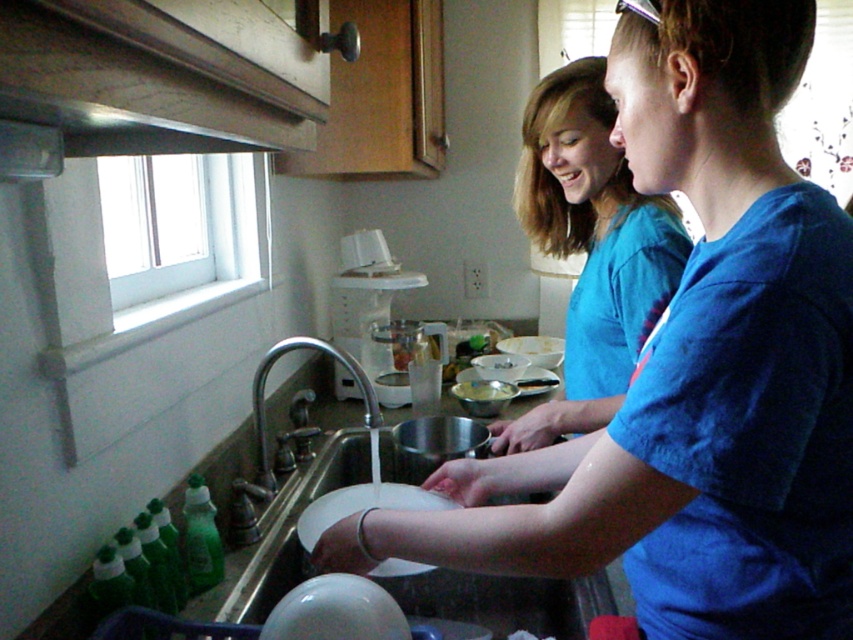
Between point (585, 362) and point (257, 369), which one is positioned behind?

Point (257, 369)

Can you confirm if blue cotton shirt at center is wider than silver metallic faucet at sink left?

Correct, the width of blue cotton shirt at center exceeds that of silver metallic faucet at sink left.

Image resolution: width=853 pixels, height=640 pixels. Describe the element at coordinates (590, 248) in the screenshot. I see `blue cotton shirt at center` at that location.

You are a GUI agent. You are given a task and a screenshot of the screen. Output one action in this format:
    pyautogui.click(x=<x>, y=<y>)
    Task: Click on the blue cotton shirt at center
    The image size is (853, 640).
    Given the screenshot: What is the action you would take?
    pyautogui.click(x=590, y=248)

Who is more distant from viewer, (581, 406) or (393, 483)?

The point (393, 483) is more distant.

Does point (614, 312) come closer to viewer compared to point (344, 497)?

No, (614, 312) is behind (344, 497).

Which is in front, point (595, 221) or point (426, 497)?

Point (426, 497)

Find the location of a particular element. The width and height of the screenshot is (853, 640). blue cotton shirt at center is located at coordinates (590, 248).

Which is more to the right, blue cotton shirt at upper right or silver metallic faucet at sink left?

blue cotton shirt at upper right

In the scene shown: Does blue cotton shirt at upper right appear on the left side of silver metallic faucet at sink left?

In fact, blue cotton shirt at upper right is to the right of silver metallic faucet at sink left.

Does point (746, 465) come farther from viewer compared to point (262, 481)?

No, it is not.

The width and height of the screenshot is (853, 640). Find the location of `blue cotton shirt at upper right`. blue cotton shirt at upper right is located at coordinates (693, 369).